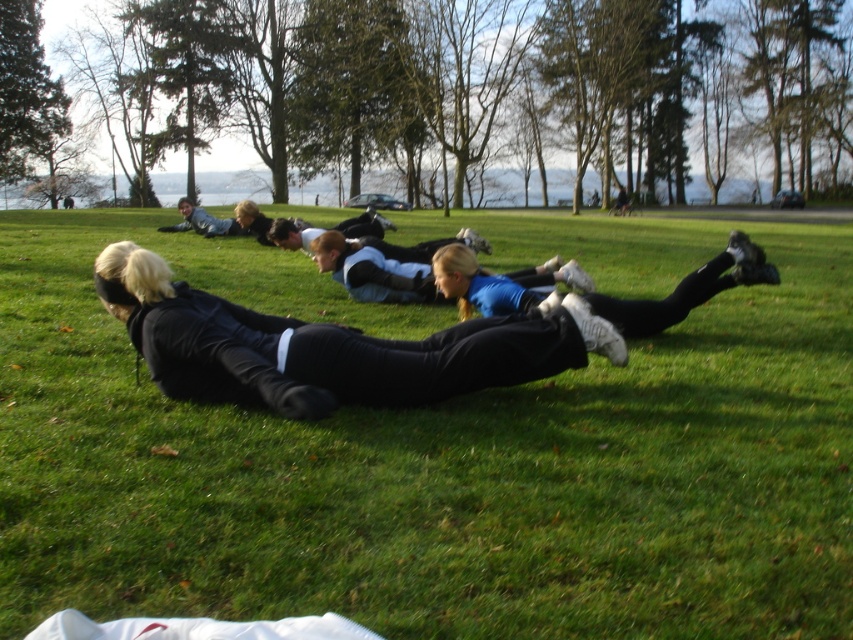
You are a photographer standing in the park and want to capture a photo of the green grass at center and the black matte leggings at center. Which object will appear larger in the photo?

The green grass at center will appear larger in the photo because it is closer to the viewer than the black matte leggings at center.

You are an athlete preparing for a training session and need to place a yoga mat. You have the green grass at center and the black matte leggings at center in your view. Which surface is more suitable for placing the yoga mat?

The green grass at center is larger in size than the black matte leggings at center, so the green grass at center would be more suitable for placing the yoga mat as it provides a stable and spacious surface.

You are standing in the park where the exercise session is happening. You notice two points marked in the image. Which point, point (730, 582) or point (373, 257), is closer to you?

Point (730, 582) is closer to the viewer than point (373, 257).